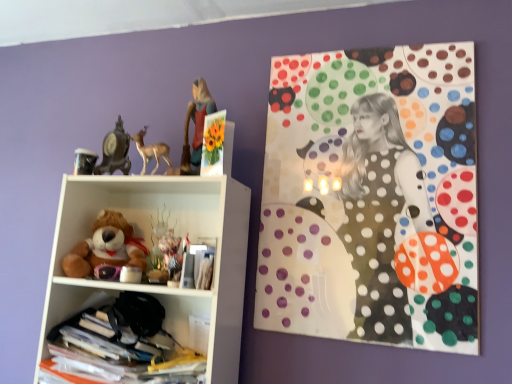
Question: From a real-world perspective, is matte black clock at upper left, placed as the first toy when sorted from top to bottom, located higher than matte black cup at upper left, which ranks as the 2th toy in bottom-to-top order?

Choices:
 (A) no
 (B) yes

Answer: (B)

Question: Does matte black clock at upper left, which is the 2th toy in left-to-right order, appear on the left side of matte black cup at upper left, which ranks as the 2th toy in bottom-to-top order?

Choices:
 (A) yes
 (B) no

Answer: (B)

Question: Does matte black clock at upper left, positioned as the third toy in bottom-to-top order, have a lesser width compared to matte black cup at upper left, the 2th toy viewed from the top?

Choices:
 (A) yes
 (B) no

Answer: (A)

Question: Is the position of matte black clock at upper left, positioned as the third toy in bottom-to-top order, more distant than that of matte black cup at upper left, which ranks as the 2th toy in bottom-to-top order?

Choices:
 (A) no
 (B) yes

Answer: (A)

Question: Considering the relative sizes of matte black clock at upper left, positioned as the third toy in bottom-to-top order, and matte black cup at upper left, which ranks as the 2th toy in bottom-to-top order, in the image provided, is matte black clock at upper left, positioned as the third toy in bottom-to-top order, smaller than matte black cup at upper left, which ranks as the 2th toy in bottom-to-top order,?

Choices:
 (A) no
 (B) yes

Answer: (A)

Question: Considering their positions, is matte black clock at upper left, placed as the first toy when sorted from top to bottom, located in front of or behind translucent plastic folders at lower left, the second shelf when ordered from top to bottom?

Choices:
 (A) behind
 (B) front

Answer: (A)

Question: Does point (118, 129) appear closer or farther from the camera than point (135, 306)?

Choices:
 (A) closer
 (B) farther

Answer: (B)

Question: Is matte black clock at upper left, placed as the first toy when sorted from top to bottom, situated inside translucent plastic folders at lower left, the second shelf when ordered from top to bottom, or outside?

Choices:
 (A) outside
 (B) inside

Answer: (A)

Question: In the image, is matte black clock at upper left, which is the 2th toy in left-to-right order, on the left side or the right side of translucent plastic folders at lower left, the second shelf when ordered from top to bottom?

Choices:
 (A) right
 (B) left

Answer: (B)

Question: Does point (197, 130) appear closer or farther from the camera than point (77, 152)?

Choices:
 (A) closer
 (B) farther

Answer: (A)

Question: In terms of height, does matte plastic figurine of girl at upper center look taller or shorter compared to matte black cup at upper left, placed as the 1th toy when sorted from left to right?

Choices:
 (A) tall
 (B) short

Answer: (A)

Question: Which is correct: matte plastic figurine of girl at upper center is inside matte black cup at upper left, which ranks as the 2th toy in bottom-to-top order, or outside of it?

Choices:
 (A) outside
 (B) inside

Answer: (A)

Question: From a real-world perspective, is matte plastic figurine of girl at upper center above or below matte black cup at upper left, placed as the 1th toy when sorted from left to right?

Choices:
 (A) below
 (B) above

Answer: (B)

Question: In the image, is polka dot fabric at upper right on the left side or the right side of matte brown deer at upper left?

Choices:
 (A) right
 (B) left

Answer: (A)

Question: Based on their sizes in the image, would you say polka dot fabric at upper right is bigger or smaller than matte brown deer at upper left?

Choices:
 (A) big
 (B) small

Answer: (A)